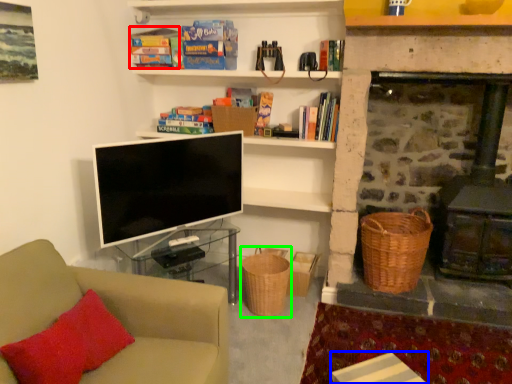
Question: Which object is the closest to the book (highlighted by a red box)? Choose among these: table (highlighted by a blue box) or basket (highlighted by a green box).

Choices:
 (A) table
 (B) basket

Answer: (B)